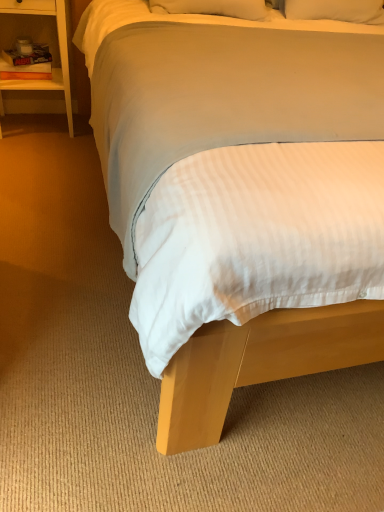
Question: Are white soft bed at center and white wood nightstand at left far apart?

Choices:
 (A) yes
 (B) no

Answer: (A)

Question: Is white soft bed at center positioned behind white wood nightstand at left?

Choices:
 (A) no
 (B) yes

Answer: (A)

Question: From the image's perspective, is white soft bed at center located above white wood nightstand at left?

Choices:
 (A) yes
 (B) no

Answer: (B)

Question: Considering the relative sizes of white soft bed at center and white wood nightstand at left in the image provided, is white soft bed at center thinner than white wood nightstand at left?

Choices:
 (A) yes
 (B) no

Answer: (B)

Question: Does white soft bed at center have a larger size compared to white wood nightstand at left?

Choices:
 (A) no
 (B) yes

Answer: (B)

Question: Does white soft bed at center have a greater height compared to white wood nightstand at left?

Choices:
 (A) no
 (B) yes

Answer: (B)

Question: Can you confirm if white wood nightstand at left is thinner than white soft bed at center?

Choices:
 (A) no
 (B) yes

Answer: (B)

Question: Is white wood nightstand at left beside white soft bed at center?

Choices:
 (A) yes
 (B) no

Answer: (B)

Question: Does white wood nightstand at left come behind white soft bed at center?

Choices:
 (A) no
 (B) yes

Answer: (B)

Question: From a real-world perspective, is white wood nightstand at left physically below white soft bed at center?

Choices:
 (A) no
 (B) yes

Answer: (B)

Question: Is white wood nightstand at left far from white soft bed at center?

Choices:
 (A) yes
 (B) no

Answer: (A)

Question: Can you confirm if white wood nightstand at left is shorter than white soft bed at center?

Choices:
 (A) yes
 (B) no

Answer: (A)

Question: Does point click(19, 89) appear closer or farther from the camera than point click(269, 336)?

Choices:
 (A) farther
 (B) closer

Answer: (A)